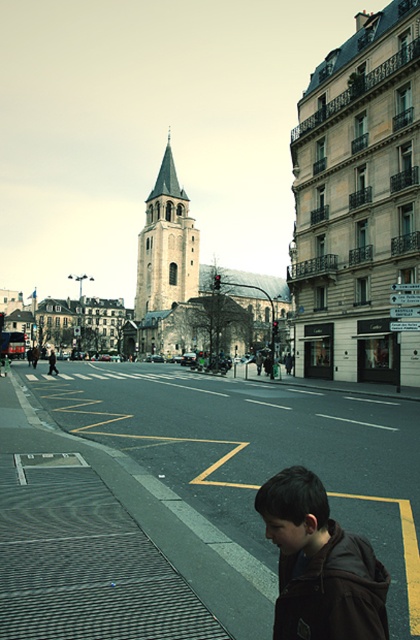
Can you confirm if brown leather jacket at lower right is bigger than stone steeple at center?

Actually, brown leather jacket at lower right might be smaller than stone steeple at center.

Does point (270, 524) come behind point (173, 198)?

No.

Which is in front, point (330, 579) or point (154, 204)?

Point (330, 579)

Identify the location of brown leather jacket at lower right. This screenshot has height=640, width=420. (320, 564).